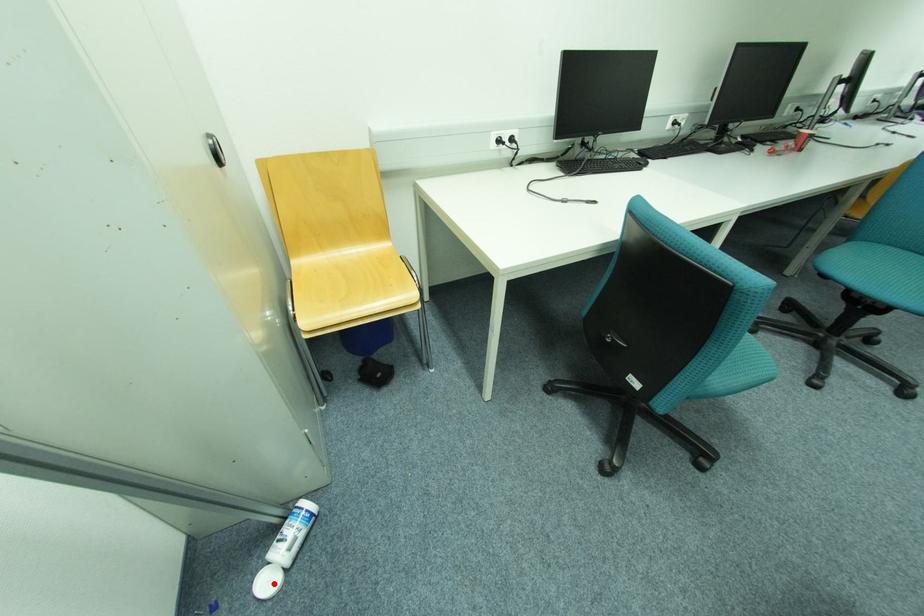
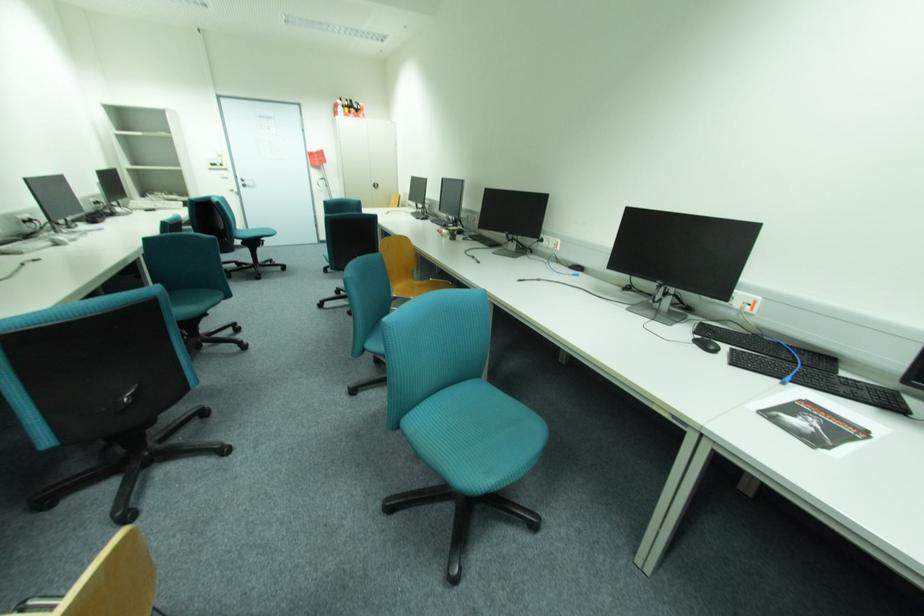
Question: I am providing you with two images of the same scene from different viewpoints. A red point is marked on the first image. Can you still see the location of the red point in image 2?

Choices:
 (A) Yes
 (B) No

Answer: (B)